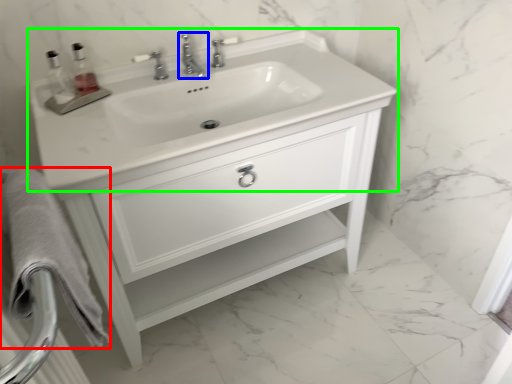
Question: Which object is positioned farthest from bath towel (highlighted by a red box)? Select from tap (highlighted by a blue box) and sink (highlighted by a green box).

Choices:
 (A) tap
 (B) sink

Answer: (A)